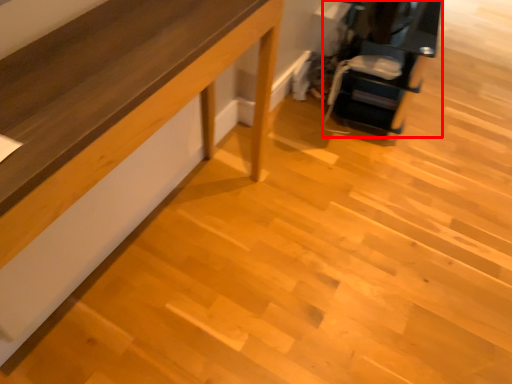
Question: Observing the image, what is the correct spatial positioning of furniture (annotated by the red box) in reference to furniture?

Choices:
 (A) right
 (B) left

Answer: (A)